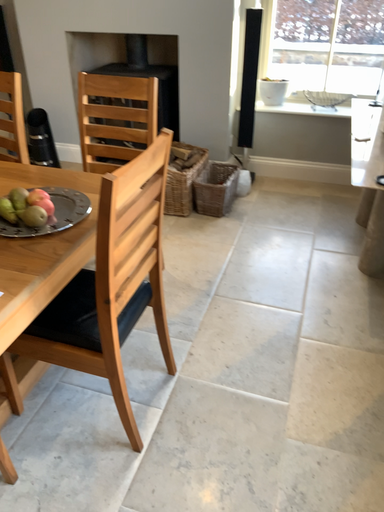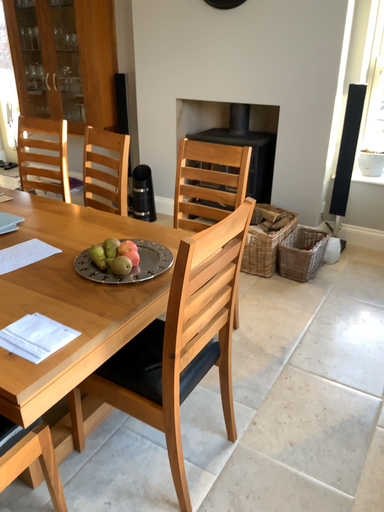
Question: How did the camera likely rotate when shooting the video?

Choices:
 (A) rotated right
 (B) rotated left

Answer: (B)